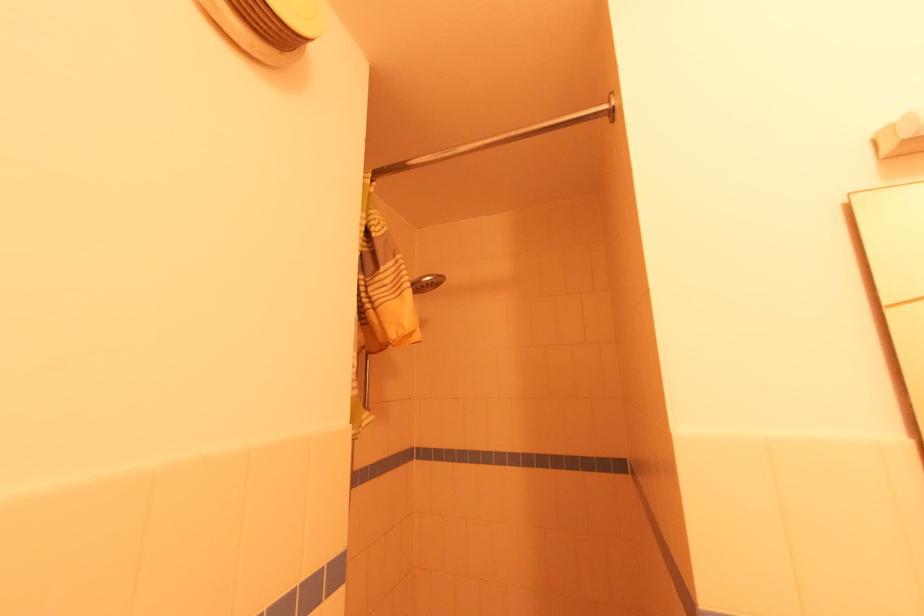
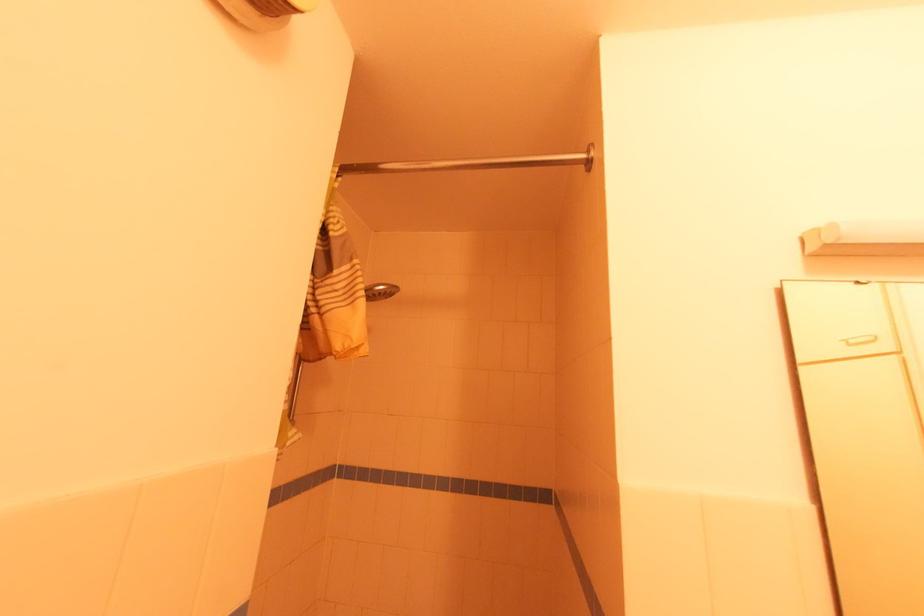
The images are taken continuously from a first-person perspective. In which direction are you moving?

The movement direction of the cameraman is left, forward.